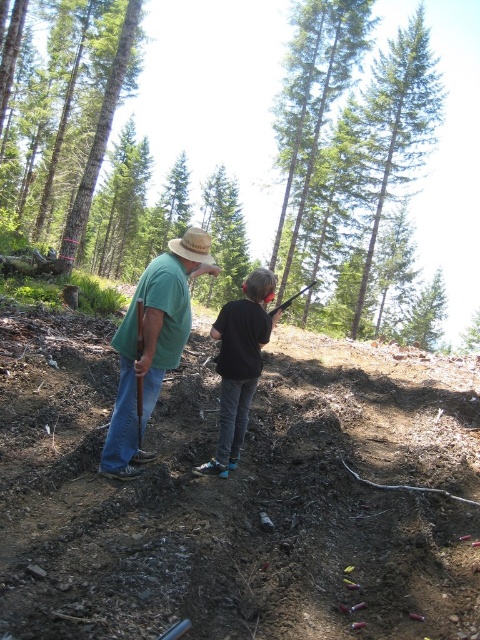
Is green leafy tree at upper center behind black matte shirt at center?

Yes, green leafy tree at upper center is behind black matte shirt at center.

Who is more distant from viewer, (384,124) or (252,376)?

Point (384,124)

What do you see at coordinates (383, 145) in the screenshot? I see `green leafy tree at upper center` at bounding box center [383, 145].

You are a GUI agent. You are given a task and a screenshot of the screen. Output one action in this format:
    pyautogui.click(x=<x>, y=<y>)
    Task: Click on the green leafy tree at upper center
    This screenshot has width=480, height=640.
    Given the screenshot: What is the action you would take?
    pyautogui.click(x=383, y=145)

Is point (84, 44) less distant than point (108, 429)?

No, it is behind (108, 429).

Where is `smooth bark tree at upper left`? This screenshot has width=480, height=640. smooth bark tree at upper left is located at coordinates (66, 122).

Locate an element on the screen. smooth bark tree at upper left is located at coordinates (66, 122).

Measure the distance between smooth bark tree at upper left and green matte tree at center.

The distance of smooth bark tree at upper left from green matte tree at center is 13.78 meters.

Is smooth bark tree at upper left above green matte tree at center?

Correct, smooth bark tree at upper left is located above green matte tree at center.

Is point (71, 35) farther from viewer compared to point (206, 205)?

That is False.

Where is `smooth bark tree at upper left`? Image resolution: width=480 pixels, height=640 pixels. smooth bark tree at upper left is located at coordinates (66, 122).